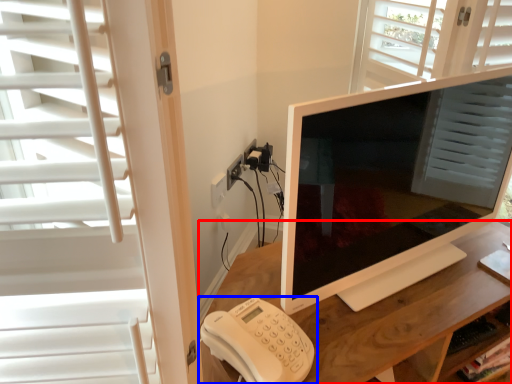
Question: Which of the following is the farthest to the observer, desk (highlighted by a red box) or corded phone (highlighted by a blue box)?

Choices:
 (A) desk
 (B) corded phone

Answer: (A)